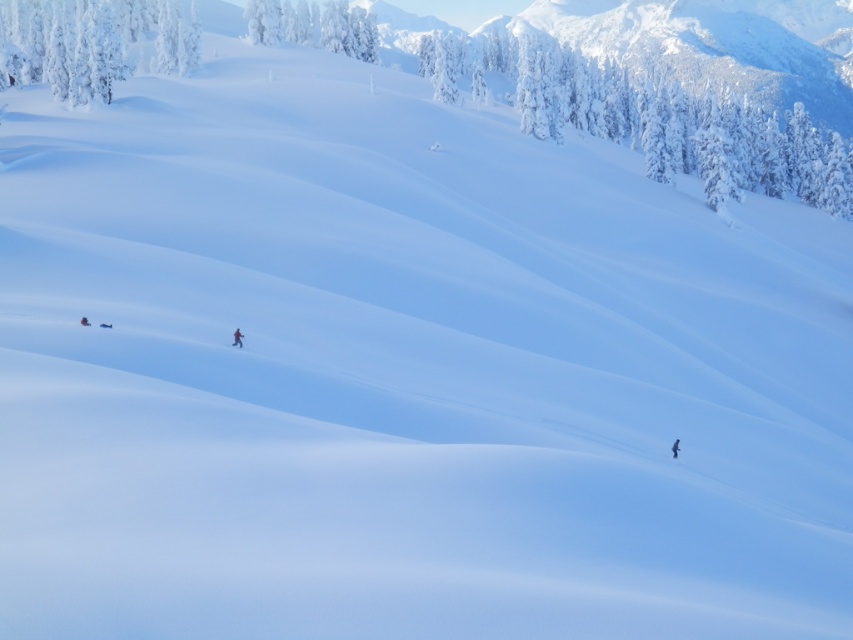
Question: Which object is farther from the camera taking this photo?

Choices:
 (A) white frosty tree at upper left
 (B) white matte ski at lower right
 (C) dark blue snowsuit at center

Answer: (A)

Question: Does red fabric person at center appear on the left side of white matte ski at lower right?

Choices:
 (A) yes
 (B) no

Answer: (A)

Question: Which of the following is the farthest from the observer?

Choices:
 (A) white frosty tree at upper left
 (B) shiny red ski at center
 (C) white frosty tree at upper center
 (D) white matte ski at lower right

Answer: (C)

Question: Is red fabric person at center thinner than shiny red ski at center?

Choices:
 (A) no
 (B) yes

Answer: (A)

Question: Is white frosty tree at upper left smaller than red fabric person at center?

Choices:
 (A) no
 (B) yes

Answer: (A)

Question: Which point is farther from the camera taking this photo?

Choices:
 (A) (675, 458)
 (B) (306, 33)
 (C) (238, 346)

Answer: (B)